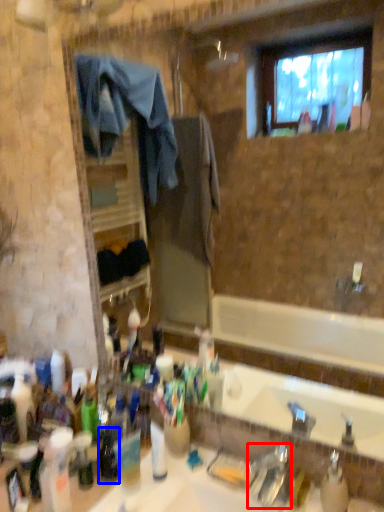
Question: Which of the following is the closest to the observer, faucet (highlighted by a red box) or bottle (highlighted by a blue box)?

Choices:
 (A) faucet
 (B) bottle

Answer: (A)